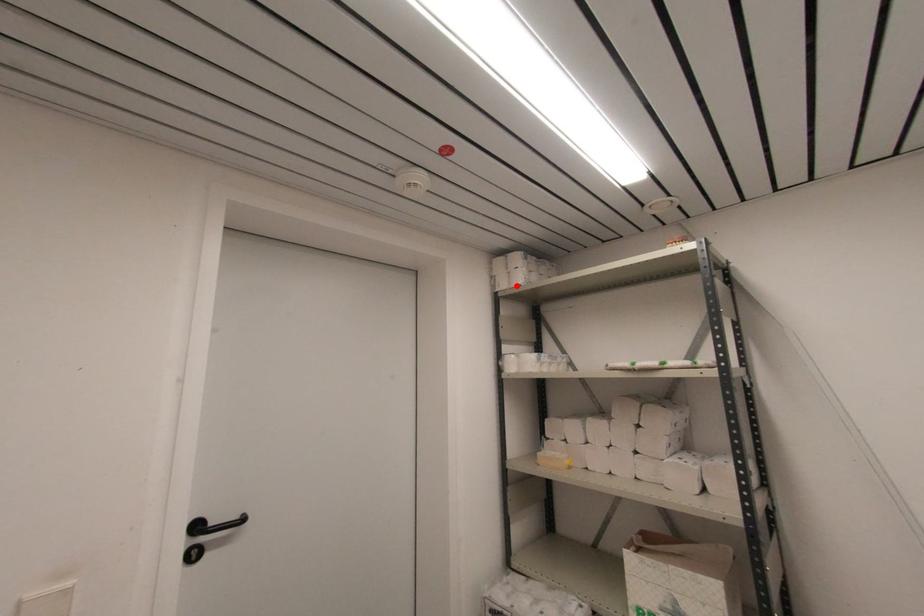
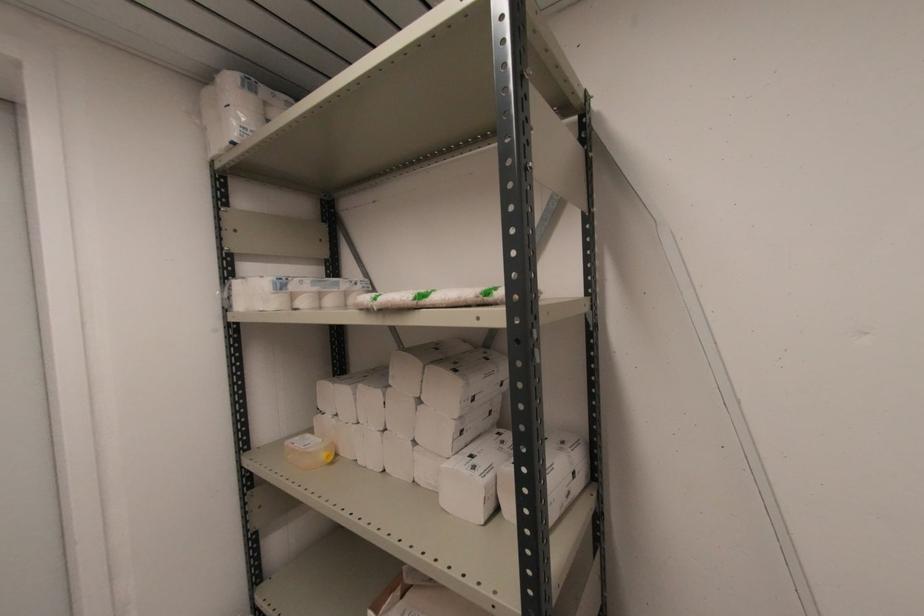
Where in the second image is the point corresponding to the highlighted location from the first image?

(227, 144)